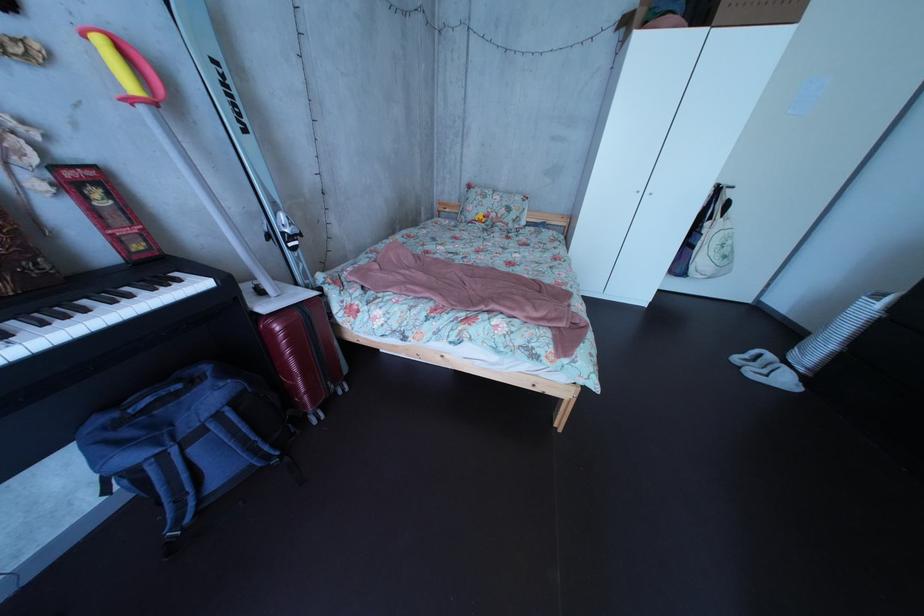
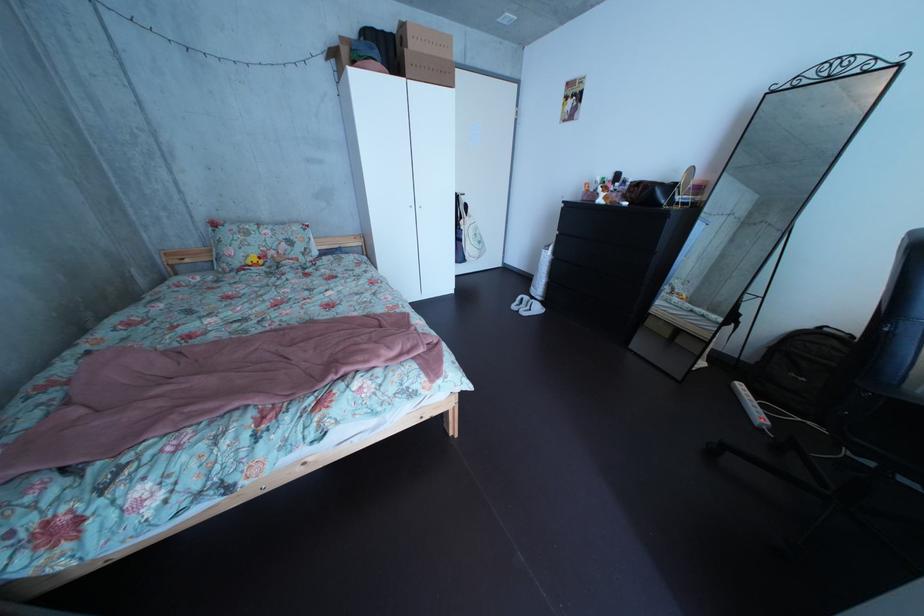
Find the pixel in the second image that matches point 490,217 in the first image.

(256, 260)